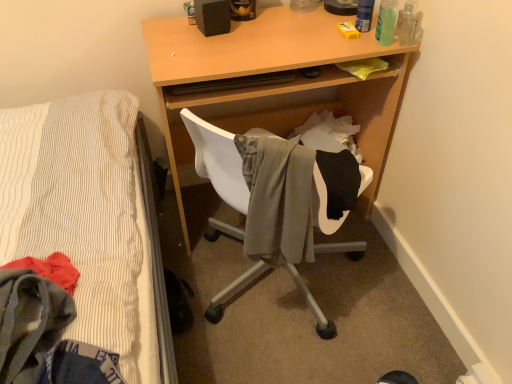
This screenshot has width=512, height=384. I want to click on free spot to the left of matte black speaker at upper center, so click(x=170, y=31).